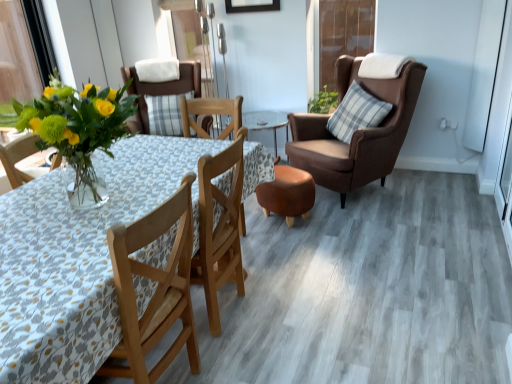
Describe the element at coordinates (357, 113) in the screenshot. I see `plaid fabric pillow at right` at that location.

Where is `matte glass vase with yellow flowers at left`? The image size is (512, 384). matte glass vase with yellow flowers at left is located at coordinates (78, 130).

Are matte brown chair at center, which is counted as the first chair, starting from the left, and brown leather chair at right, placed as the first chair when sorted from right to left, located far from each other?

Yes, matte brown chair at center, which is counted as the first chair, starting from the left, and brown leather chair at right, placed as the first chair when sorted from right to left, are located far from each other.

Does point (138, 86) appear closer or farther from the camera than point (401, 101)?

Point (138, 86) is farther from the camera than point (401, 101).

From a real-world perspective, relative to brown leather chair at right, which ranks as the second chair in left-to-right order, is matte brown chair at center, which is counted as the first chair, starting from the left, vertically above or below?

In terms of real-world spatial position, matte brown chair at center, which is counted as the first chair, starting from the left, is above brown leather chair at right, which ranks as the second chair in left-to-right order.

From the picture: Is wooden floral-patterned table at center at the right side of transparent plastic screen door at upper center?

In fact, wooden floral-patterned table at center is to the left of transparent plastic screen door at upper center.

How much distance is there between wooden floral-patterned table at center and transparent plastic screen door at upper center?

wooden floral-patterned table at center and transparent plastic screen door at upper center are 2.35 meters apart from each other.

Is wooden floral-patterned table at center turned away from transparent plastic screen door at upper center?

No.

From the image's perspective, which one is positioned higher, wooden floral-patterned table at center or transparent plastic screen door at upper center?

transparent plastic screen door at upper center, from the image's perspective.

Based on their positions, is matte glass vase with yellow flowers at left located to the left or right of matte brown chair at center, the 2th chair when ordered from right to left?

From the image, it's evident that matte glass vase with yellow flowers at left is to the right of matte brown chair at center, the 2th chair when ordered from right to left.

Is matte glass vase with yellow flowers at left positioned with its back to matte brown chair at center, which is counted as the first chair, starting from the left?

Absolutely, matte glass vase with yellow flowers at left is directed away from matte brown chair at center, which is counted as the first chair, starting from the left.

Does matte glass vase with yellow flowers at left touch matte brown chair at center, which is counted as the first chair, starting from the left?

No, matte glass vase with yellow flowers at left is not in contact with matte brown chair at center, which is counted as the first chair, starting from the left.

Consider the image. Is matte glass vase with yellow flowers at left taller than matte brown chair at center, the 2th chair when ordered from right to left?

No, matte glass vase with yellow flowers at left is not taller than matte brown chair at center, the 2th chair when ordered from right to left.

Where is `pillow located on the right of transparent plastic screen door at upper center`? pillow located on the right of transparent plastic screen door at upper center is located at coordinates (357, 113).

Considering the sizes of objects plaid fabric pillow at right and transparent plastic screen door at upper center in the image provided, who is smaller, plaid fabric pillow at right or transparent plastic screen door at upper center?

transparent plastic screen door at upper center.

Is point (350, 131) closer or farther from the camera than point (332, 52)?

Point (350, 131) is closer to the camera than point (332, 52).

Is plaid fabric pillow at right not near transparent plastic screen door at upper center?

No, plaid fabric pillow at right is not far from transparent plastic screen door at upper center.

Is plaid fabric pillow at right situated inside matte brown chair at center, the 2th chair when ordered from right to left, or outside?

plaid fabric pillow at right is not enclosed by matte brown chair at center, the 2th chair when ordered from right to left.

Can you confirm if plaid fabric pillow at right is wider than matte brown chair at center, the 2th chair when ordered from right to left?

Incorrect, the width of plaid fabric pillow at right does not surpass that of matte brown chair at center, the 2th chair when ordered from right to left.

In the image, is plaid fabric pillow at right positioned in front of or behind matte brown chair at center, the 2th chair when ordered from right to left?

In the image, plaid fabric pillow at right appears in front of matte brown chair at center, the 2th chair when ordered from right to left.

Is point (353, 112) positioned in front of point (155, 92)?

Yes, it is.

Can we say matte brown chair at center, which is counted as the first chair, starting from the left, lies outside wooden floral-patterned table at center?

matte brown chair at center, which is counted as the first chair, starting from the left, lies outside wooden floral-patterned table at center's area.

Which of these two, matte brown chair at center, the 2th chair when ordered from right to left, or wooden floral-patterned table at center, stands shorter?

matte brown chair at center, the 2th chair when ordered from right to left.

Measure the distance from matte brown chair at center, the 2th chair when ordered from right to left, to wooden floral-patterned table at center.

They are 2.10 meters apart.

Is matte brown chair at center, which is counted as the first chair, starting from the left, to the left of wooden floral-patterned table at center from the viewer's perspective?

Yes.

Can you tell me how much brown leather chair at right, which ranks as the second chair in left-to-right order, and matte glass vase with yellow flowers at left differ in facing direction?

The angle between the facing direction of brown leather chair at right, which ranks as the second chair in left-to-right order, and the facing direction of matte glass vase with yellow flowers at left is 31.1 degrees.

Is brown leather chair at right, placed as the first chair when sorted from right to left, shorter than matte glass vase with yellow flowers at left?

No.

Which is more to the right, brown leather chair at right, placed as the first chair when sorted from right to left, or matte glass vase with yellow flowers at left?

From the viewer's perspective, brown leather chair at right, placed as the first chair when sorted from right to left, appears more on the right side.

From the image's perspective, which one is positioned lower, brown leather chair at right, which ranks as the second chair in left-to-right order, or matte glass vase with yellow flowers at left?

From the image's view, matte glass vase with yellow flowers at left is below.

Where is `chair below the matte brown chair at center, which is counted as the first chair, starting from the left (from the image's perspective)`? chair below the matte brown chair at center, which is counted as the first chair, starting from the left (from the image's perspective) is located at coordinates (356, 132).

Identify the location of kitchen & dining room table in front of the transparent plastic screen door at upper center. (77, 259).

Considering their positions, is transparent plastic screen door at upper center positioned closer to matte glass vase with yellow flowers at left than matte brown chair at center, the 2th chair when ordered from right to left?

Among the two, matte brown chair at center, the 2th chair when ordered from right to left, is located nearer to matte glass vase with yellow flowers at left.

Estimate the real-world distances between objects in this image. Which object is further from matte glass vase with yellow flowers at left, matte brown chair at center, the 2th chair when ordered from right to left, or transparent plastic screen door at upper center?

transparent plastic screen door at upper center.

Estimate the real-world distances between objects in this image. Which object is further from plaid fabric pillow at right, matte brown chair at center, which is counted as the first chair, starting from the left, or brown leather chair at right, placed as the first chair when sorted from right to left?

matte brown chair at center, which is counted as the first chair, starting from the left, is positioned further to the anchor plaid fabric pillow at right.

Which object lies further to the anchor point transparent plastic screen door at upper center, plaid fabric pillow at right or matte brown chair at center, which is counted as the first chair, starting from the left?

matte brown chair at center, which is counted as the first chair, starting from the left.

From the image, which object appears to be farther from plaid fabric pillow at right, matte brown chair at center, which is counted as the first chair, starting from the left, or wooden floral-patterned table at center?

The object further to plaid fabric pillow at right is wooden floral-patterned table at center.

Based on their spatial positions, is matte brown chair at center, which is counted as the first chair, starting from the left, or wooden floral-patterned table at center further from matte glass vase with yellow flowers at left?

The object further to matte glass vase with yellow flowers at left is matte brown chair at center, which is counted as the first chair, starting from the left.

Which object lies nearer to the anchor point matte glass vase with yellow flowers at left, brown leather chair at right, which ranks as the second chair in left-to-right order, or transparent plastic screen door at upper center?

brown leather chair at right, which ranks as the second chair in left-to-right order.

Which object lies further to the anchor point brown leather chair at right, which ranks as the second chair in left-to-right order, plaid fabric pillow at right or transparent plastic screen door at upper center?

The object further to brown leather chair at right, which ranks as the second chair in left-to-right order, is transparent plastic screen door at upper center.

This screenshot has width=512, height=384. In order to click on pillow positioned between brown leather chair at right, which ranks as the second chair in left-to-right order, and transparent plastic screen door at upper center from near to far in this screenshot , I will do pos(357,113).

Find the location of a particular element. Image resolution: width=512 pixels, height=384 pixels. pillow between matte glass vase with yellow flowers at left and matte brown chair at center, which is counted as the first chair, starting from the left, in the front-back direction is located at coordinates (357, 113).

Locate an element on the screen. This screenshot has width=512, height=384. floral arrangement between wooden floral-patterned table at center and matte brown chair at center, which is counted as the first chair, starting from the left, along the z-axis is located at coordinates (78, 130).

This screenshot has height=384, width=512. Find the location of `chair positioned between matte glass vase with yellow flowers at left and plaid fabric pillow at right from near to far`. chair positioned between matte glass vase with yellow flowers at left and plaid fabric pillow at right from near to far is located at coordinates (356, 132).